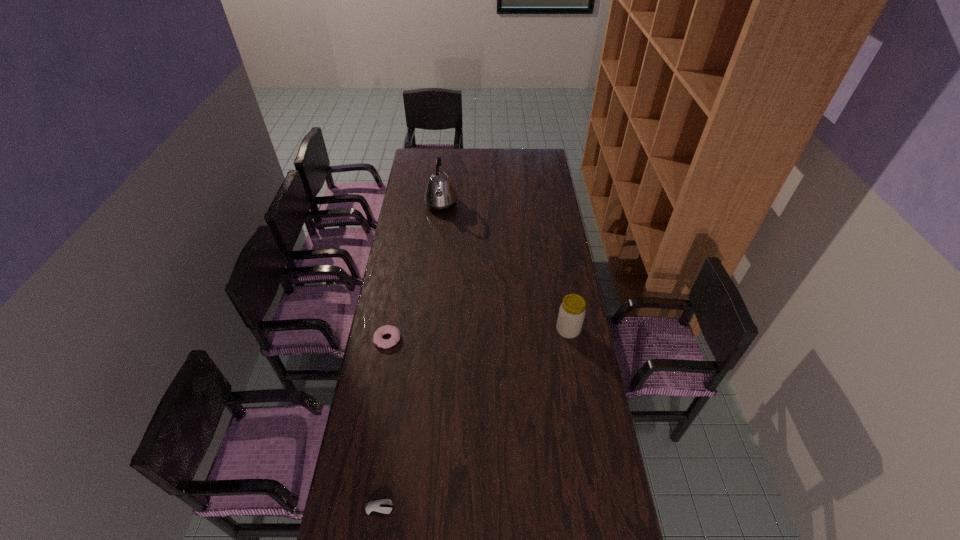
Find the location of a particular element. vacant area that lies between the doughnut and the mouse is located at coordinates [x=383, y=423].

Locate an element on the screen. This screenshot has height=540, width=960. vacant area that lies between the nearest object and the farthest object is located at coordinates (410, 357).

Locate an element on the screen. The height and width of the screenshot is (540, 960). free space between the second tallest object and the farthest object is located at coordinates (505, 267).

Where is `unoccupied position between the jar and the doughnut`? This screenshot has height=540, width=960. unoccupied position between the jar and the doughnut is located at coordinates (x=478, y=334).

Identify the location of blank region between the tallest object and the doughnut. (415, 272).

Where is `free spot between the nearest object and the doughnut`? free spot between the nearest object and the doughnut is located at coordinates (383, 423).

Where is `vacant space that is in between the rightmost object and the doughnut`? vacant space that is in between the rightmost object and the doughnut is located at coordinates (478, 334).

Point out which object is positioned as the second nearest to the nearest object. Please provide its 2D coordinates. Your answer should be formatted as a tuple, i.e. [(x, y)], where the tuple contains the x and y coordinates of a point satisfying the conditions above.

[(571, 315)]

Select which object appears as the second closest to the doughnut. Please provide its 2D coordinates. Your answer should be formatted as a tuple, i.e. [(x, y)], where the tuple contains the x and y coordinates of a point satisfying the conditions above.

[(571, 315)]

The width and height of the screenshot is (960, 540). In order to click on free space that satisfies the following two spatial constraints: 1. on the back side of the jar; 2. on the right side of the mouse in this screenshot , I will do `click(405, 330)`.